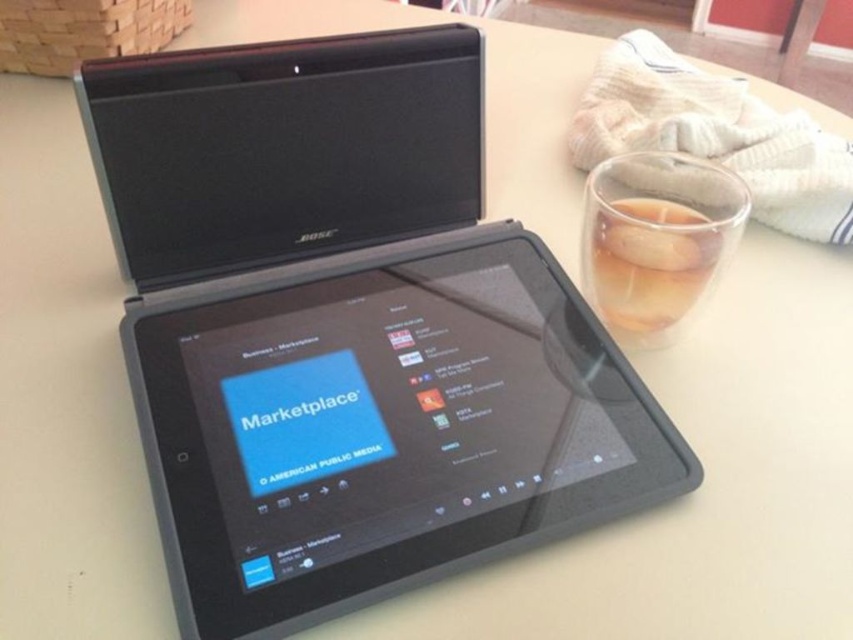
You are sitting at the workspace and want to reach for the tablet. There are two points marked on the table. Which point is closer to you, point (190, 356) or point (680, 321)?

Point (190, 356) is in front of point (680, 321), so it is closer to you.

From the picture: You need to place a phone charger that is 12 inches long on the table between the black matte tablet at center and the translucent glass cup at right. Considering their widths, will the charger fit horizontally between them without overlapping either object?

The black matte tablet at center is wider than the translucent glass cup at right. Since the charger is 12 inches long, and the space between them must accommodate its length, the charger can fit horizontally as the tablet and cup are positioned side by side with sufficient width to allow placement without overlapping.

Consider the image. You are organizing a desk and need to place the black matte tablet at center and the translucent glass cup at right. According to the current setup, which object is positioned lower on the desk?

The black matte tablet at center is located below the translucent glass cup at right, so it is positioned lower on the desk.